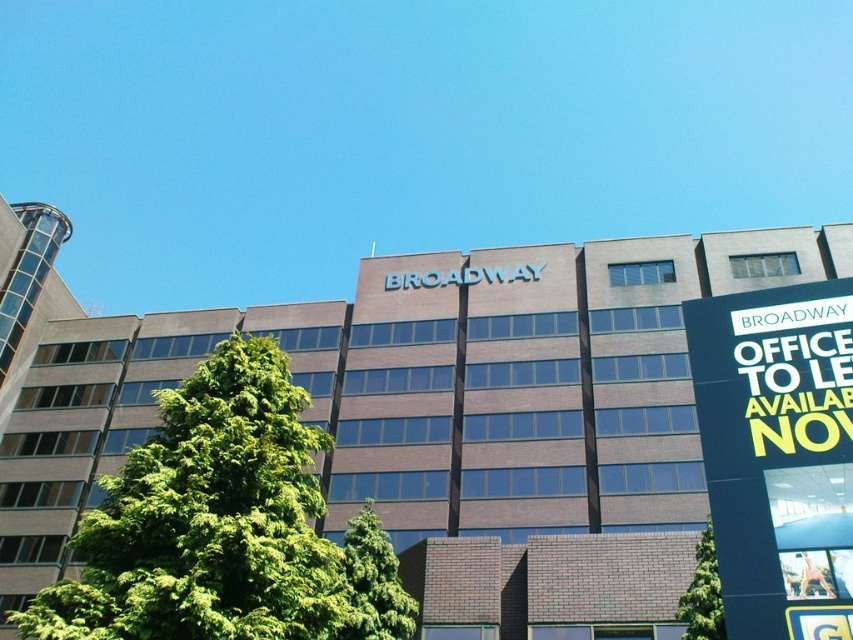
Can you confirm if green leafy tree at left is positioned to the left of green leafy tree at center?

Indeed, green leafy tree at left is positioned on the left side of green leafy tree at center.

Is green leafy tree at left below green leafy tree at center?

No, green leafy tree at left is not below green leafy tree at center.

Which is in front, point (311, 604) or point (689, 637)?

Point (311, 604) is more forward.

At what (x,y) coordinates should I click in order to perform the action: click on green leafy tree at left. Please return your answer as a coordinate pair (x, y). The image size is (853, 640). Looking at the image, I should click on (224, 525).

Which is behind, point (746, 572) or point (721, 637)?

The point (721, 637) is behind.

Is blue plastic signboard at upper right taller than green leafy tree at center?

No.

Locate an element on the screen. blue plastic signboard at upper right is located at coordinates (778, 454).

I want to click on blue plastic signboard at upper right, so click(x=778, y=454).

From the picture: Between green leafy tree at left and blue plastic signboard at upper right, which one appears on the right side from the viewer's perspective?

From the viewer's perspective, blue plastic signboard at upper right appears more on the right side.

Can you confirm if green leafy tree at left is bigger than blue plastic signboard at upper right?

Correct, green leafy tree at left is larger in size than blue plastic signboard at upper right.

Between point (247, 346) and point (688, 317), which one is positioned behind?

The point (247, 346) is more distant.

Identify the location of green leafy tree at left. This screenshot has height=640, width=853. (224, 525).